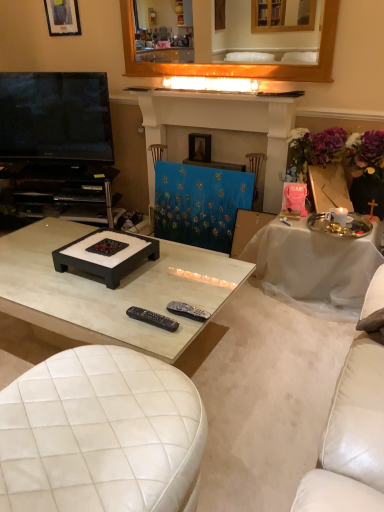
Locate an element on the screen. The height and width of the screenshot is (512, 384). vacant space in front of black plastic remote at center, marked as the 1th remote control in a right-to-left arrangement is located at coordinates (167, 343).